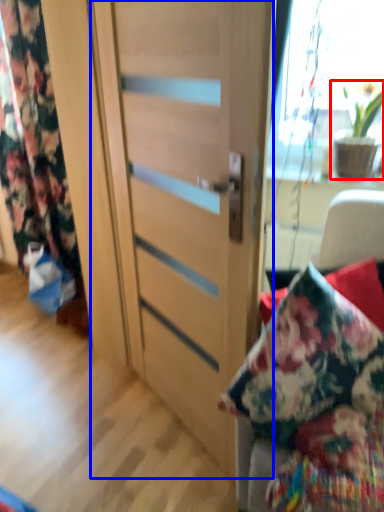
Question: Which object appears closest to the camera in this image, houseplant (highlighted by a red box) or door (highlighted by a blue box)?

Choices:
 (A) houseplant
 (B) door

Answer: (B)